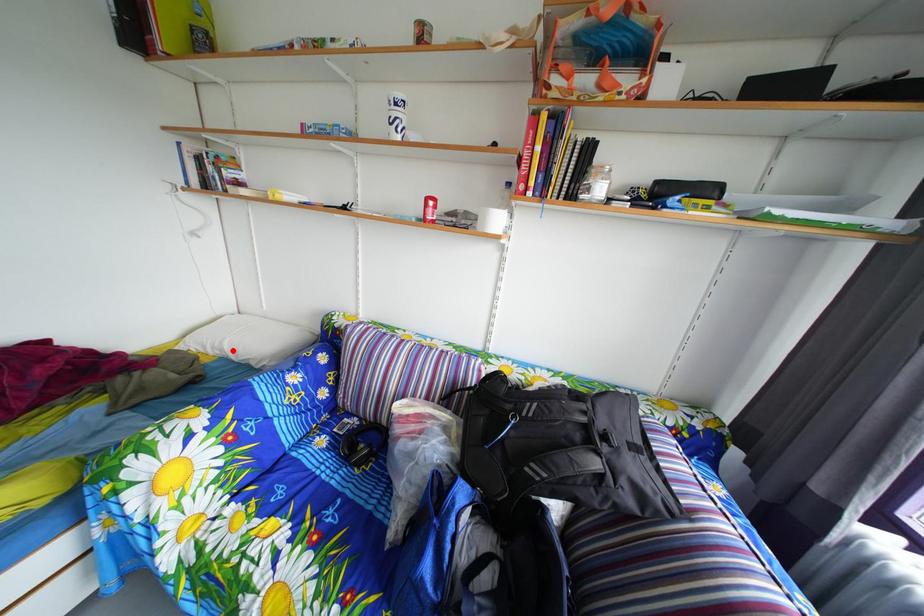
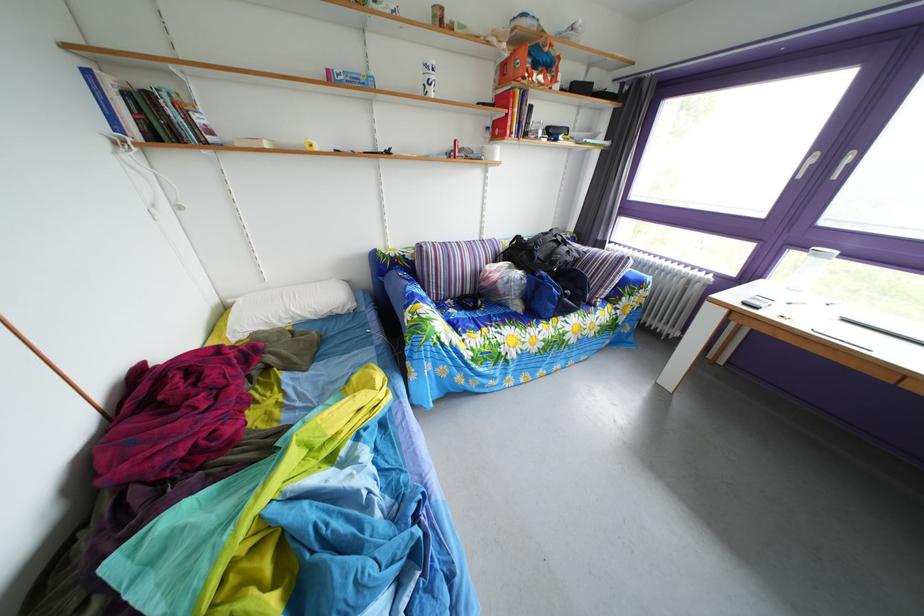
Find the pixel in the second image that matches the highlighted location in the first image.

(298, 320)